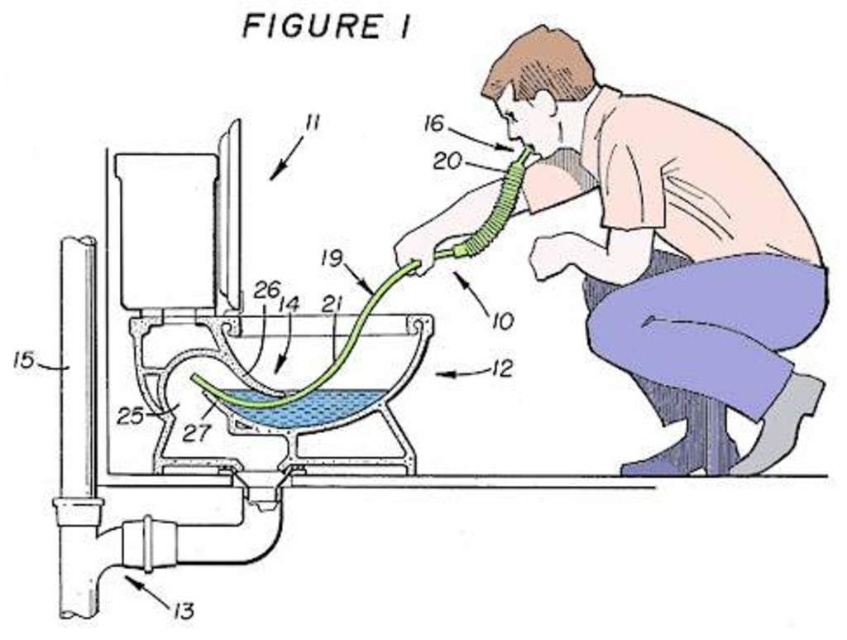
Measure the distance from pink fabric shirt at upper right to green rubber hose at center.

A distance of 28.01 inches exists between pink fabric shirt at upper right and green rubber hose at center.

Between pink fabric shirt at upper right and green rubber hose at center, which one has more height?

pink fabric shirt at upper right

Image resolution: width=847 pixels, height=640 pixels. In order to click on pink fabric shirt at upper right in this screenshot , I will do `click(670, 252)`.